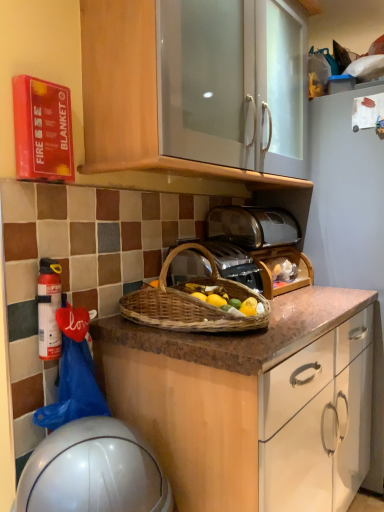
Question: Is satin silver toaster at center aimed at white matte fire extinguisher at left?

Choices:
 (A) no
 (B) yes

Answer: (A)

Question: From a real-world perspective, is satin silver toaster at center physically below white matte fire extinguisher at left?

Choices:
 (A) no
 (B) yes

Answer: (A)

Question: Considering the relative sizes of satin silver toaster at center and white matte fire extinguisher at left in the image provided, is satin silver toaster at center smaller than white matte fire extinguisher at left?

Choices:
 (A) no
 (B) yes

Answer: (A)

Question: Is satin silver toaster at center behind white matte fire extinguisher at left?

Choices:
 (A) yes
 (B) no

Answer: (A)

Question: Is satin silver toaster at center positioned in front of white matte fire extinguisher at left?

Choices:
 (A) no
 (B) yes

Answer: (A)

Question: Is satin silver toaster at center at the right side of white matte fire extinguisher at left?

Choices:
 (A) no
 (B) yes

Answer: (B)

Question: Can you confirm if metallic silver toaster at center is bigger than white matte fire extinguisher at left?

Choices:
 (A) no
 (B) yes

Answer: (B)

Question: From the image's perspective, is metallic silver toaster at center on white matte fire extinguisher at left?

Choices:
 (A) no
 (B) yes

Answer: (B)

Question: Is metallic silver toaster at center thinner than white matte fire extinguisher at left?

Choices:
 (A) no
 (B) yes

Answer: (A)

Question: Is metallic silver toaster at center closer to camera compared to white matte fire extinguisher at left?

Choices:
 (A) no
 (B) yes

Answer: (A)

Question: Is metallic silver toaster at center smaller than white matte fire extinguisher at left?

Choices:
 (A) no
 (B) yes

Answer: (A)

Question: Is metallic silver toaster at center positioned behind white matte fire extinguisher at left?

Choices:
 (A) no
 (B) yes

Answer: (B)

Question: Is white glossy helmet at lower left not within woven brown picnic basket at center?

Choices:
 (A) yes
 (B) no

Answer: (A)